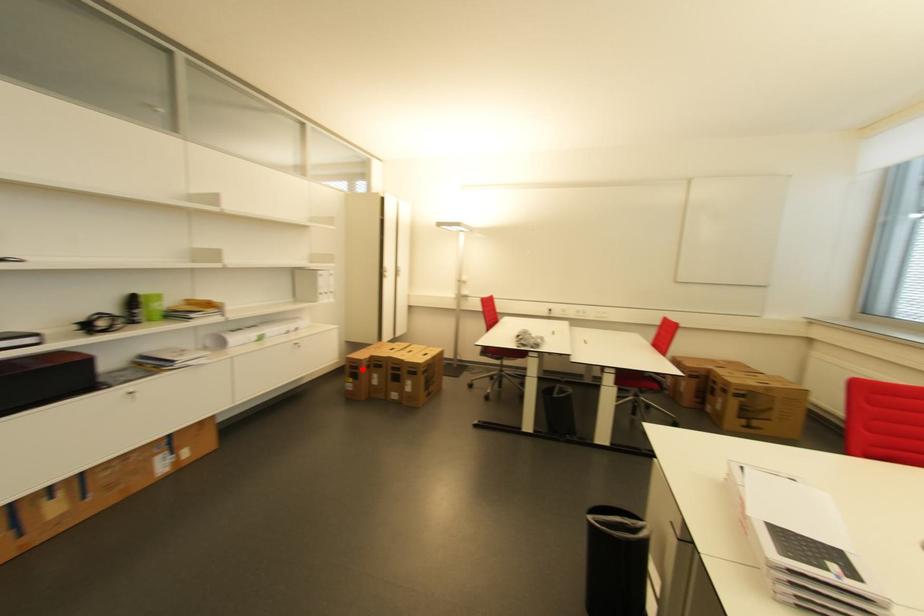
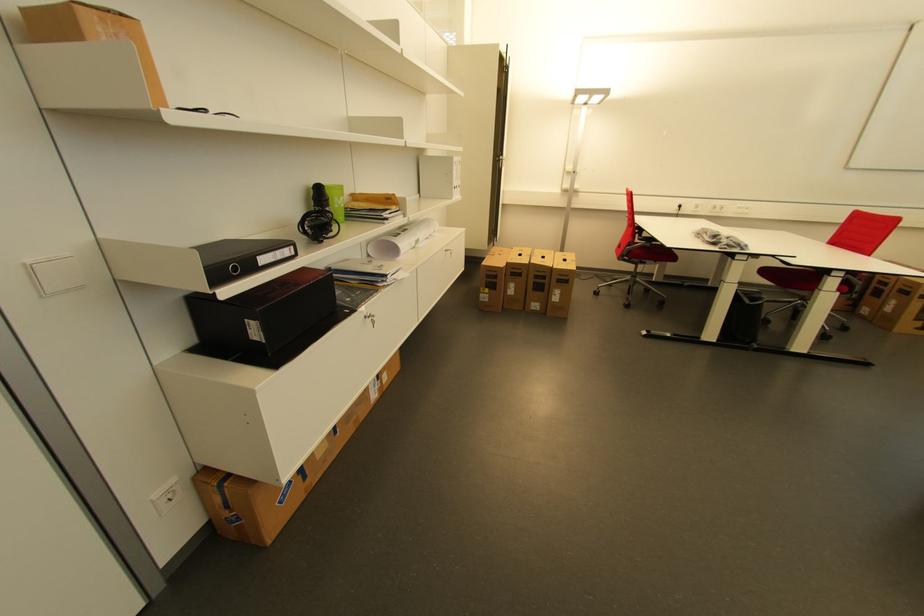
Locate, in the second image, the point that corresponds to the highlighted location in the first image.

(502, 278)